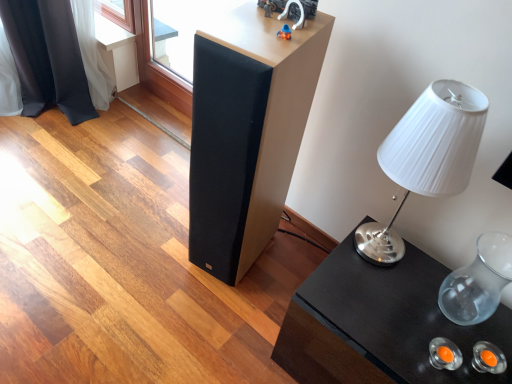
Question: From the image's perspective, is black glossy table at lower right above matte black speaker at center?

Choices:
 (A) yes
 (B) no

Answer: (B)

Question: From the image's perspective, does black glossy table at lower right appear lower than matte black speaker at center?

Choices:
 (A) no
 (B) yes

Answer: (B)

Question: Does black glossy table at lower right have a smaller size compared to matte black speaker at center?

Choices:
 (A) no
 (B) yes

Answer: (A)

Question: Is black glossy table at lower right shorter than matte black speaker at center?

Choices:
 (A) no
 (B) yes

Answer: (B)

Question: Is black glossy table at lower right taller than matte black speaker at center?

Choices:
 (A) yes
 (B) no

Answer: (B)

Question: Looking at their shapes, would you say white pleated fabric lampshade at right is wider or thinner than black glossy table at lower right?

Choices:
 (A) wide
 (B) thin

Answer: (B)

Question: Considering the relative positions of white pleated fabric lampshade at right and black glossy table at lower right in the image provided, is white pleated fabric lampshade at right to the left or to the right of black glossy table at lower right?

Choices:
 (A) right
 (B) left

Answer: (B)

Question: Is white pleated fabric lampshade at right bigger or smaller than black glossy table at lower right?

Choices:
 (A) small
 (B) big

Answer: (A)

Question: In terms of height, does white pleated fabric lampshade at right look taller or shorter compared to black glossy table at lower right?

Choices:
 (A) short
 (B) tall

Answer: (B)

Question: Considering their positions, is black glossy table at lower right located in front of or behind matte black speaker at center?

Choices:
 (A) front
 (B) behind

Answer: (A)

Question: Is point (391, 362) positioned closer to the camera than point (232, 195)?

Choices:
 (A) farther
 (B) closer

Answer: (B)

Question: From the image's perspective, is black glossy table at lower right above or below matte black speaker at center?

Choices:
 (A) above
 (B) below

Answer: (B)

Question: Looking at their shapes, would you say black glossy table at lower right is wider or thinner than matte black speaker at center?

Choices:
 (A) thin
 (B) wide

Answer: (B)

Question: Considering their positions, is matte black speaker at center located in front of or behind transparent glass vase at right?

Choices:
 (A) front
 (B) behind

Answer: (A)

Question: From the image's perspective, relative to transparent glass vase at right, is matte black speaker at center above or below?

Choices:
 (A) below
 (B) above

Answer: (B)